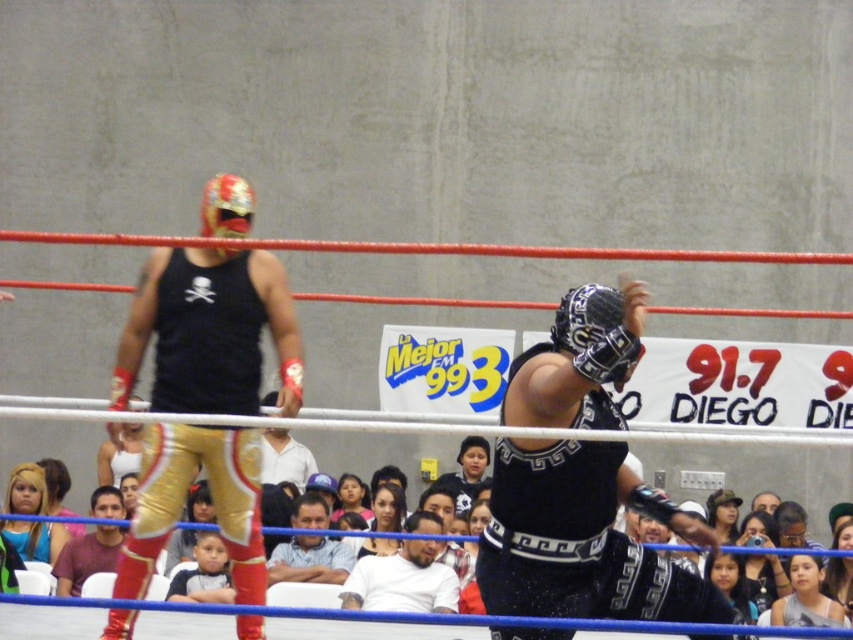
Can you confirm if black satin mask at center is shorter than white matte shirt at center?

Yes, black satin mask at center is shorter than white matte shirt at center.

Is black satin mask at center to the right of white matte shirt at center from the viewer's perspective?

Yes, black satin mask at center is to the right of white matte shirt at center.

You are a GUI agent. You are given a task and a screenshot of the screen. Output one action in this format:
    pyautogui.click(x=<x>, y=<y>)
    Task: Click on the black satin mask at center
    Image resolution: width=853 pixels, height=640 pixels.
    Given the screenshot: What is the action you would take?
    pyautogui.click(x=582, y=540)

Is the position of metallic gold pants at left more distant than that of white matte shirt at center?

No, it is not.

Can you confirm if metallic gold pants at left is positioned above white matte shirt at center?

Correct, metallic gold pants at left is located above white matte shirt at center.

What are the coordinates of `metallic gold pants at left` in the screenshot? It's located at (209, 332).

Who is lower down, black satin mask at center or metallic gold pants at left?

Positioned lower is black satin mask at center.

Who is more distant from viewer, (548, 632) or (227, 449)?

The point (227, 449) is more distant.

Locate an element on the screen. The width and height of the screenshot is (853, 640). black satin mask at center is located at coordinates (582, 540).

You are a GUI agent. You are given a task and a screenshot of the screen. Output one action in this format:
    pyautogui.click(x=<x>, y=<y>)
    Task: Click on the black satin mask at center
    
    Given the screenshot: What is the action you would take?
    pyautogui.click(x=582, y=540)